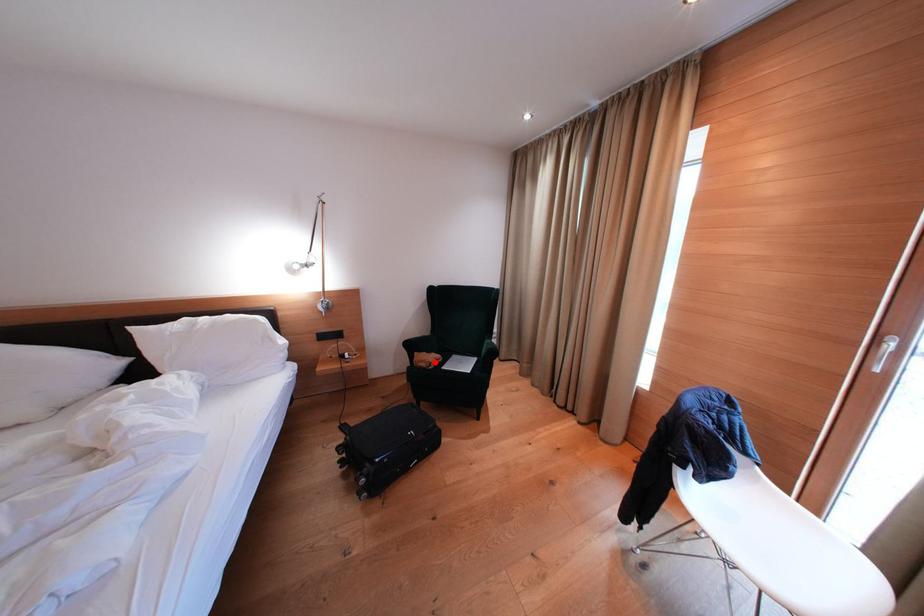
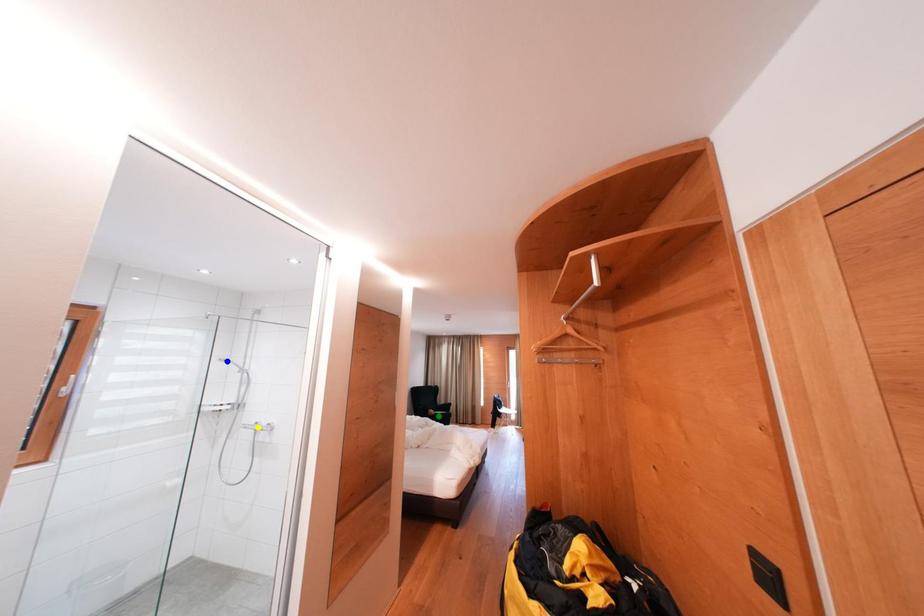
Question: I am providing you with two images of the same scene from different viewpoints. A red point is marked on the first image. You are given multiple points on the second image. Can you choose the point in image 2 that corresponds to the point in image 1?

Choices:
 (A) green point
 (B) yellow point
 (C) blue point

Answer: (A)